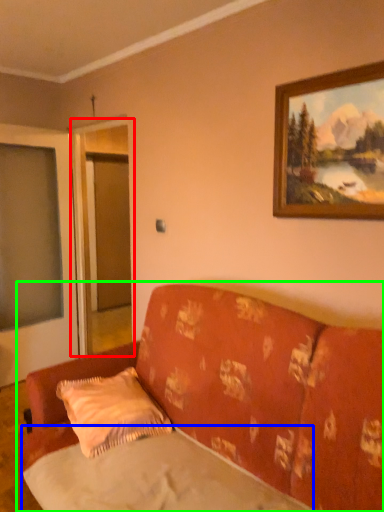
Question: Which is farther away from screen door (highlighted by a red box)? sheet (highlighted by a blue box) or studio couch (highlighted by a green box)?

Choices:
 (A) sheet
 (B) studio couch

Answer: (A)